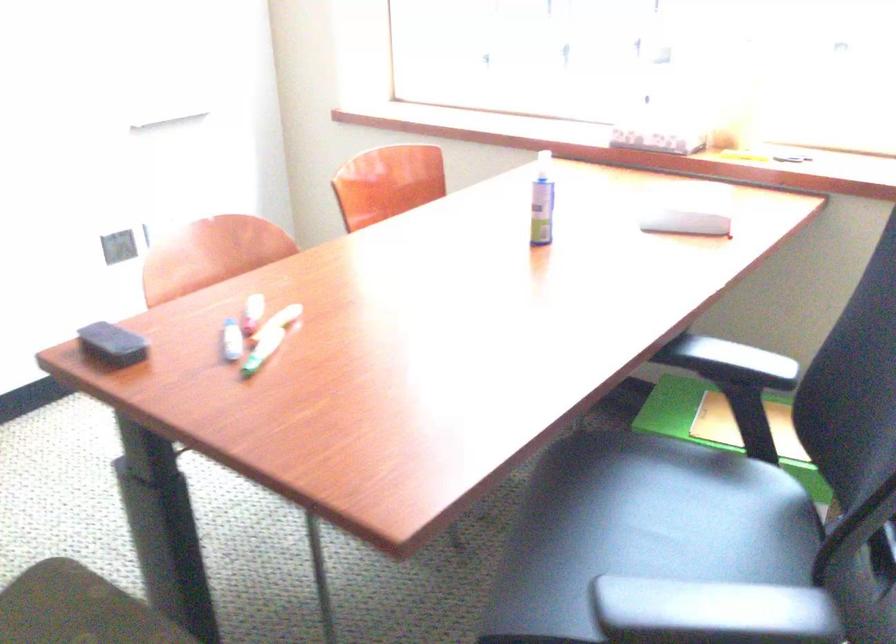
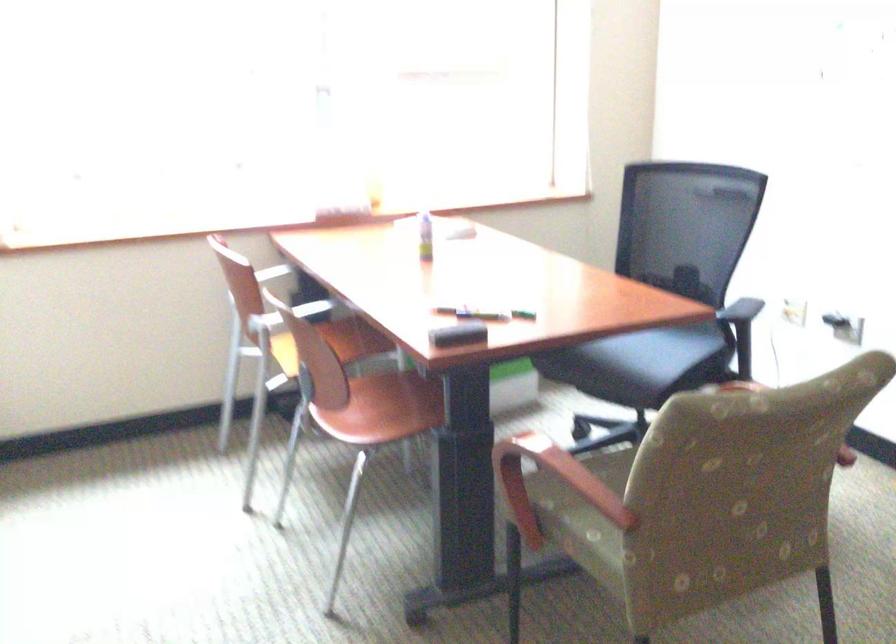
In the second image, find the point that corresponds to point 545,213 in the first image.

(425, 236)